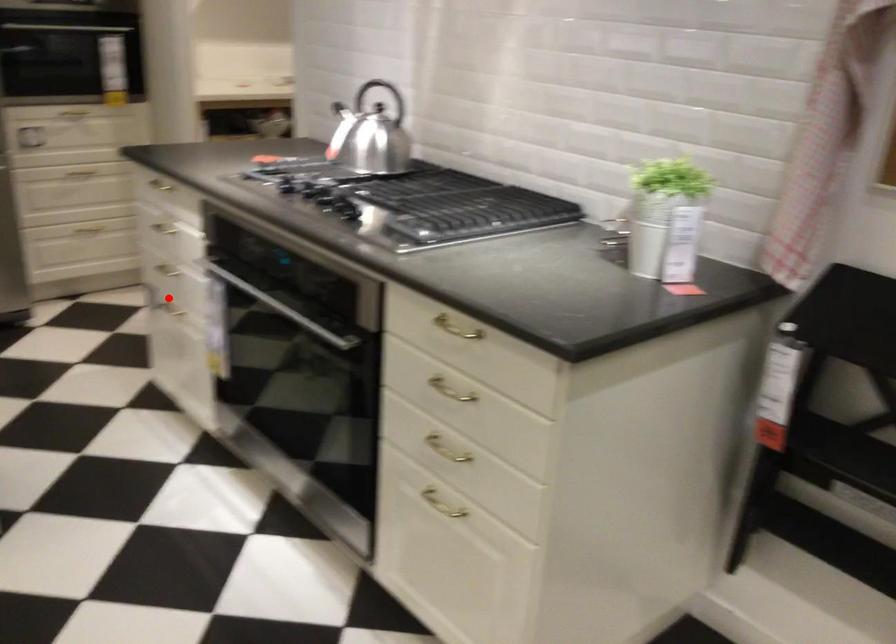
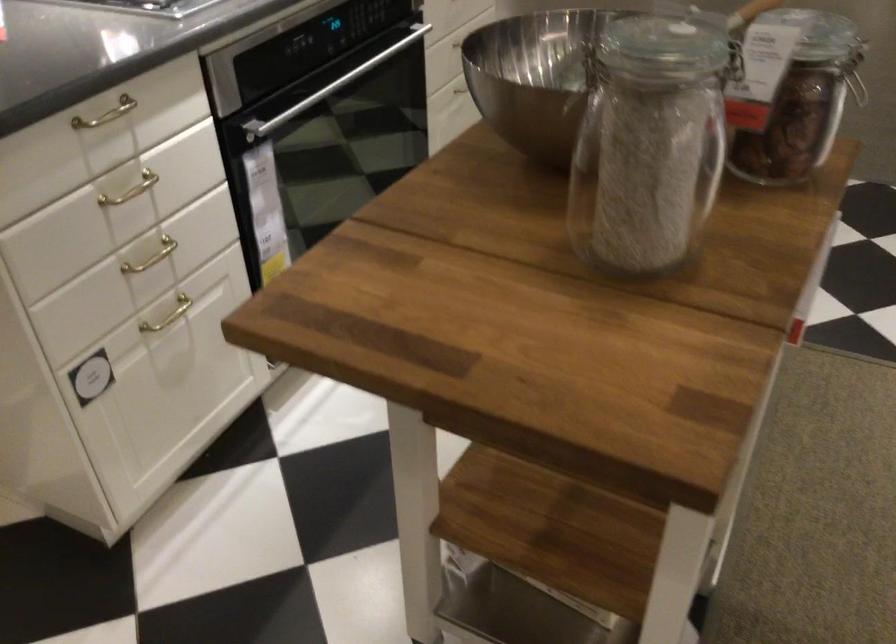
Find the pixel in the second image that matches the highlighted location in the first image.

(168, 315)